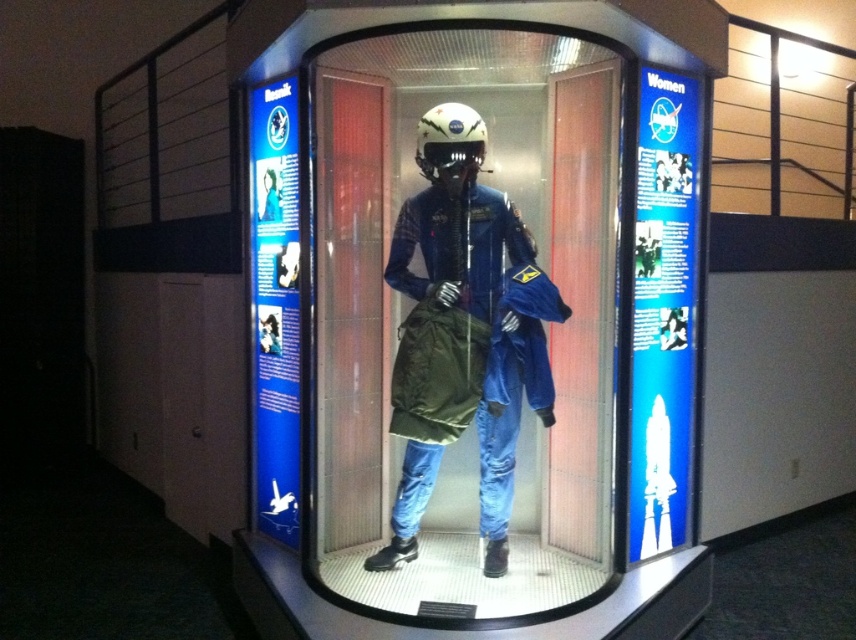
You are a security guard in the museum. You need to ensure that the blue fabric spacesuit at center is positioned exactly at the center of the display case. According to the coordinates provided, is the spacesuit properly centered?

The blue fabric spacesuit at center is located at coordinates (464, 332), which are very close to the exact center of the display case. Since the coordinates are nearly perfect, the spacesuit is properly centered.

You are a museum visitor holding a small camera. You want to take a photo of the white matte helmet at center through the transparent plastic display case at center. Can you see the entire helmet in the photo without any obstruction from the display case?

The transparent plastic display case at center is much taller than the white matte helmet at center, so yes, the entire helmet can be seen in the photo without obstruction from the display case.

You are a museum visitor holding a 6 inch wide flashlight. You want to place it between the transparent plastic display case at center and the blue fabric spacesuit at center. Is there enough space to fit it there?

The distance between the transparent plastic display case at center and the blue fabric spacesuit at center is 5.28 inches, which is less than the 6 inch width of the flashlight. Therefore, there is not enough space to fit the flashlight between them.